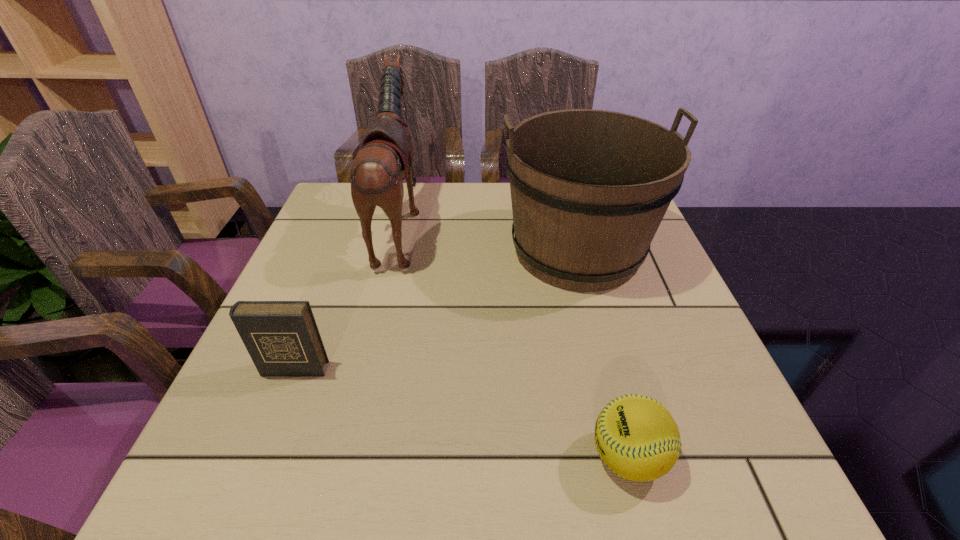
I want to click on free space between the saddle and the nearest object, so click(x=514, y=341).

The width and height of the screenshot is (960, 540). I want to click on free area in between the softball and the bucket, so click(602, 354).

The height and width of the screenshot is (540, 960). What are the coordinates of `vacant space in between the bucket and the leftmost object` in the screenshot? It's located at (436, 310).

This screenshot has width=960, height=540. What are the coordinates of `unoccupied position between the nearest object and the third farthest object` in the screenshot? It's located at (461, 413).

At what (x,y) coordinates should I click in order to perform the action: click on empty location between the bucket and the diary. Please return your answer as a coordinate pair (x, y). This screenshot has height=540, width=960. Looking at the image, I should click on (436, 310).

Identify which object is the nearest to the softball. Please provide its 2D coordinates. Your answer should be formatted as a tuple, i.e. [(x, y)], where the tuple contains the x and y coordinates of a point satisfying the conditions above.

[(589, 188)]

Identify which object is the second closest to the diary. Please provide its 2D coordinates. Your answer should be formatted as a tuple, i.e. [(x, y)], where the tuple contains the x and y coordinates of a point satisfying the conditions above.

[(589, 188)]

This screenshot has width=960, height=540. In order to click on free spot that satisfies the following two spatial constraints: 1. on the back of the third object from right to left; 2. on the front cover of the third farthest object in this screenshot , I will do `click(365, 369)`.

The height and width of the screenshot is (540, 960). Identify the location of free space that satisfies the following two spatial constraints: 1. on the back of the third object from right to left; 2. on the front cover of the second nearest object. (365, 369).

The width and height of the screenshot is (960, 540). I want to click on free spot that satisfies the following two spatial constraints: 1. on the back of the saddle; 2. on the left side of the bucket, so click(394, 251).